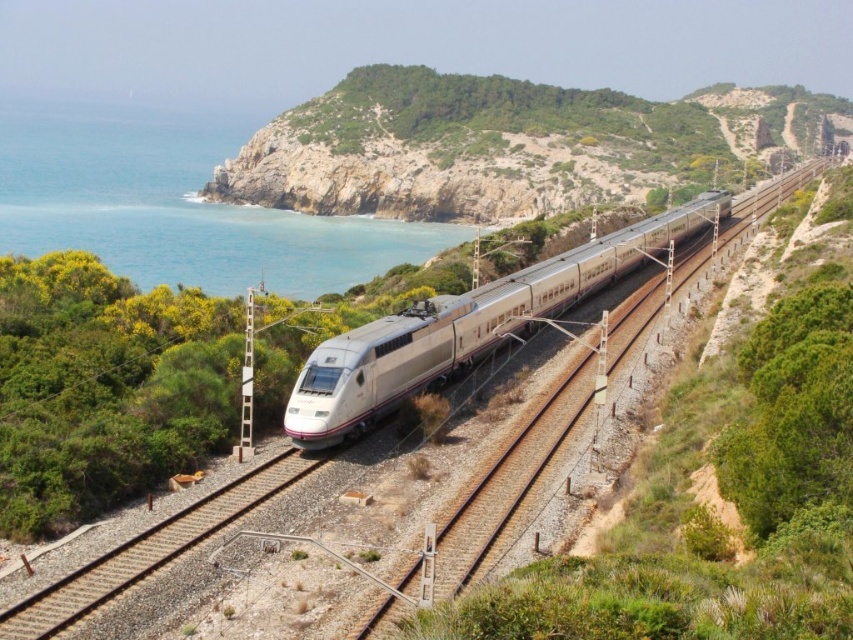
Question: Observing the image, what is the correct spatial positioning of green grassy hillside at center in reference to silver metallic bullet train at center?

Choices:
 (A) left
 (B) right

Answer: (B)

Question: Which point is farther to the camera?

Choices:
 (A) pyautogui.click(x=360, y=141)
 (B) pyautogui.click(x=389, y=372)
 (C) pyautogui.click(x=146, y=180)
 (D) pyautogui.click(x=151, y=540)

Answer: (C)

Question: Can you confirm if green grassy hillside at center is positioned below blue water at left?

Choices:
 (A) no
 (B) yes

Answer: (A)

Question: Estimate the real-world distances between objects in this image. Which object is farther from the metal/smooth train track at center?

Choices:
 (A) green grassy hillside at center
 (B) silver metallic bullet train at center
 (C) blue water at left

Answer: (A)

Question: Which point is farther from the camera taking this photo?

Choices:
 (A) (103, 250)
 (B) (622, 241)
 (C) (718, 160)
 (D) (149, 563)

Answer: (C)

Question: Is green grassy hillside at center closer to camera compared to metal/smooth train track at center?

Choices:
 (A) yes
 (B) no

Answer: (B)